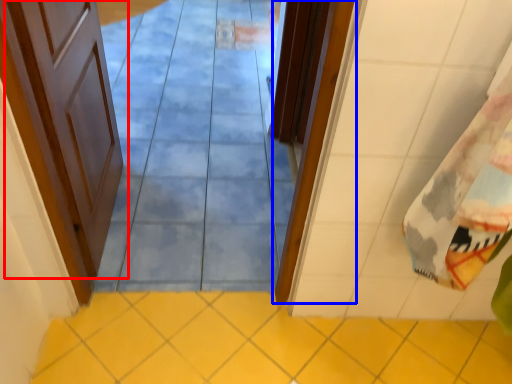
Question: Among these objects, which one is nearest to the camera, door (highlighted by a red box) or door (highlighted by a blue box)?

Choices:
 (A) door
 (B) door

Answer: (A)